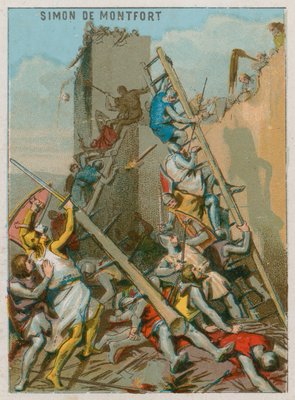
Where is `wall`? wall is located at coordinates (271, 147).